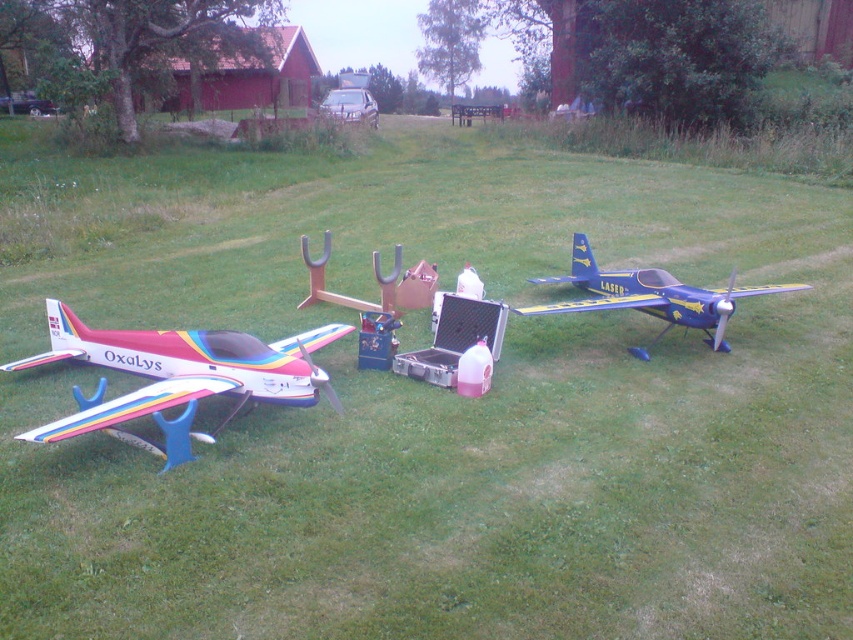
Describe the element at coordinates (178, 376) in the screenshot. The image size is (853, 640). I see `rainbow painted model airplane at left` at that location.

I want to click on rainbow painted model airplane at left, so click(178, 376).